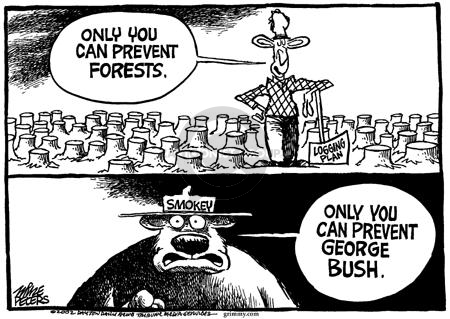
At what (x,y) coordinates should I click in order to perform the action: click on bottom frame of picture. Please return your answer as a coordinate pair (x, y). The width and height of the screenshot is (450, 319). Looking at the image, I should click on (117, 222).